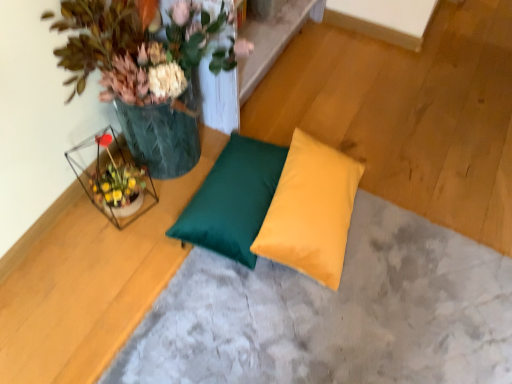
Question: From a real-world perspective, is yellow satin pillow at center, marked as the second pillow in a left-to-right arrangement, positioned above or below matte green pillow at center?

Choices:
 (A) below
 (B) above

Answer: (B)

Question: From the image's perspective, relative to matte green pillow at center, is yellow satin pillow at center, the first pillow viewed from the right, above or below?

Choices:
 (A) above
 (B) below

Answer: (A)

Question: Considering the real-world distances, which object is farthest from the matte green pillow at center?

Choices:
 (A) green leafy plant at upper left
 (B) satin green pillow at center, which is the 1th pillow in left-to-right order
 (C) yellow satin pillow at center, marked as the second pillow in a left-to-right arrangement

Answer: (A)

Question: Estimate the real-world distances between objects in this image. Which object is farther from the green leafy plant at upper left?

Choices:
 (A) matte green pillow at center
 (B) yellow satin pillow at center, the first pillow viewed from the right
 (C) satin green pillow at center, the 2th pillow viewed from the right

Answer: (A)